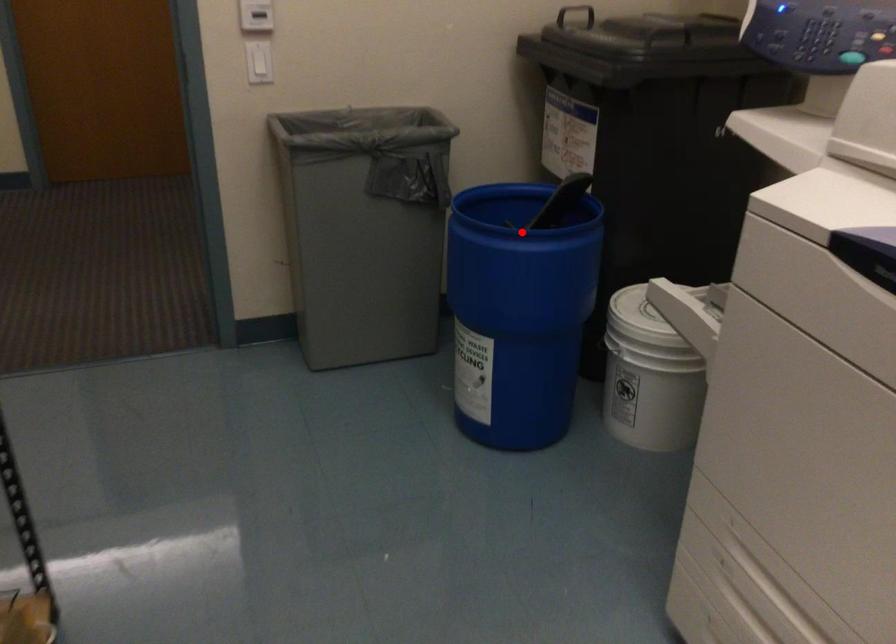
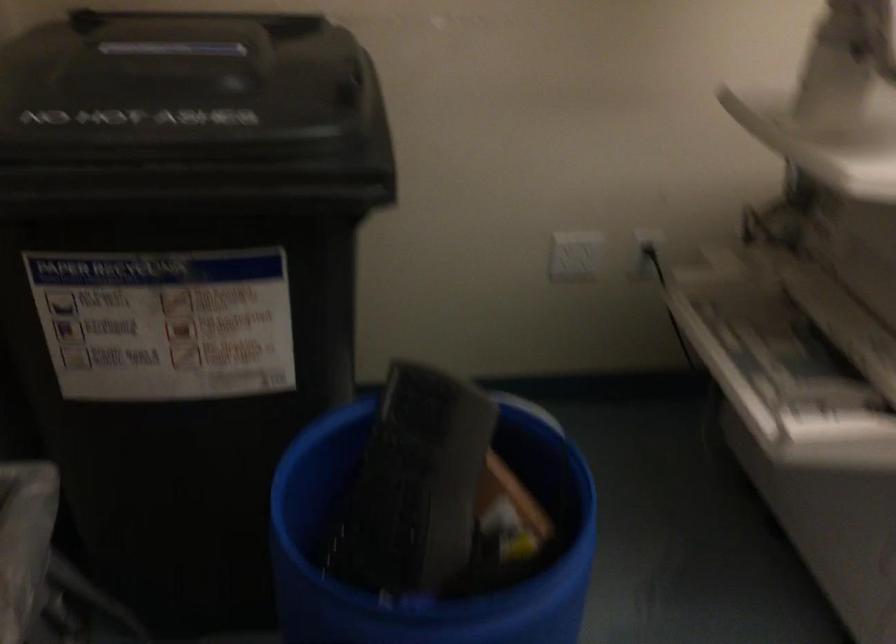
Question: I am providing you with two images of the same scene from different viewpoints. Given a red point in image1, look at the same physical point in image2. Is it:

Choices:
 (A) Closer to the viewpoint
 (B) Farther from the viewpoint

Answer: (A)